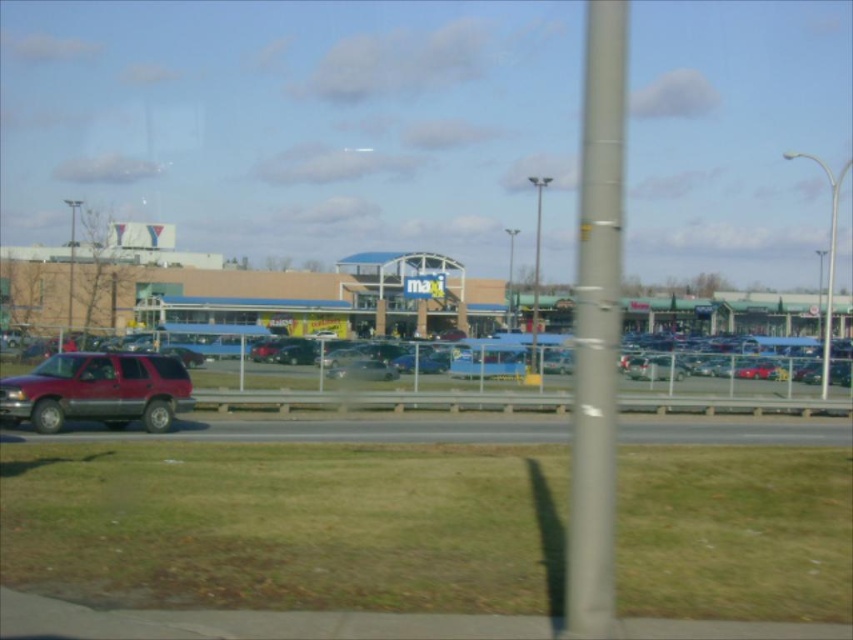
You are a delivery driver who needs to park your shiny maroon suv at left in the gray asphalt highway at lower center. Is there enough space for your vehicle?

The gray asphalt highway at lower center is larger in size than the shiny maroon suv at left, so there should be enough space to park the shiny maroon suv at left there.

You are a delivery driver who needs to park your car in the parking lot. The parking lot has a grid system with coordinates. The entrance to the parking lot is at point 0,0. The metallic silver cars at center are parked at point 0.617,0.437. If your car is at point 0.5,0.5, can you drive straight to the entrance without moving any cars?

The metallic silver cars at center are parked at point (x=372, y=394). Since your car is at (x=426, y=320), which is closer to the entrance than the metallic silver cars at center, you can drive straight to the entrance without moving any cars.